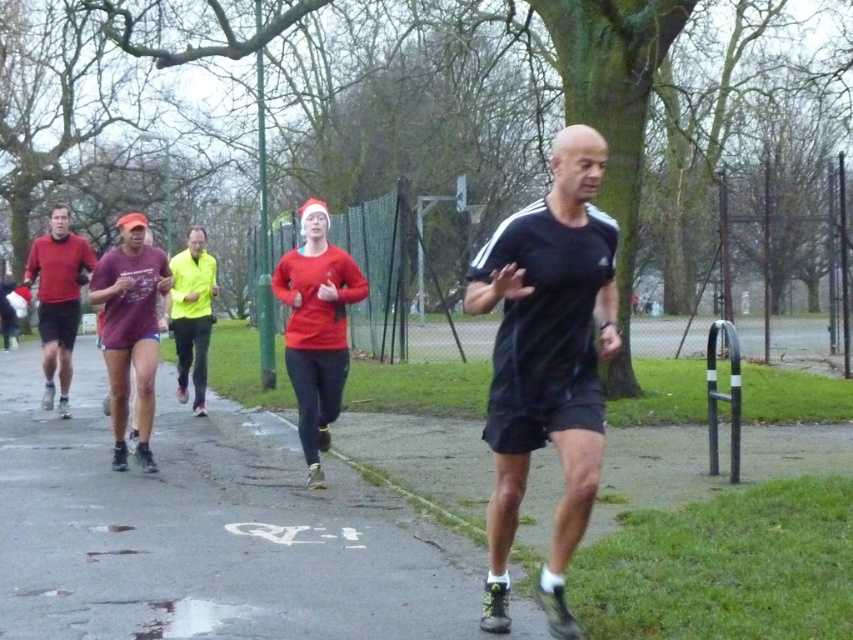
Looking at this image, who is more forward, (x=67, y=600) or (x=567, y=230)?

Positioned in front is point (x=567, y=230).

Does point (7, 605) come in front of point (547, 250)?

No, (7, 605) is behind (547, 250).

Identify the location of smooth asphalt path at center. (206, 532).

Which is more to the left, black matte running shoe at center or red matte sweater at center?

red matte sweater at center

Which is above, black matte running shoe at center or red matte sweater at center?

red matte sweater at center

Identify the location of black matte running shoe at center. (547, 360).

Can you confirm if matte purple shorts at center is taller than matte red shirt at left?

Incorrect, matte purple shorts at center's height is not larger of matte red shirt at left's.

Who is taller, matte purple shorts at center or matte red shirt at left?

matte red shirt at left is taller.

Who is more distant from viewer, (154,314) or (70,250)?

The point (70,250) is behind.

Image resolution: width=853 pixels, height=640 pixels. In order to click on matte purple shorts at center in this screenshot , I will do `click(131, 330)`.